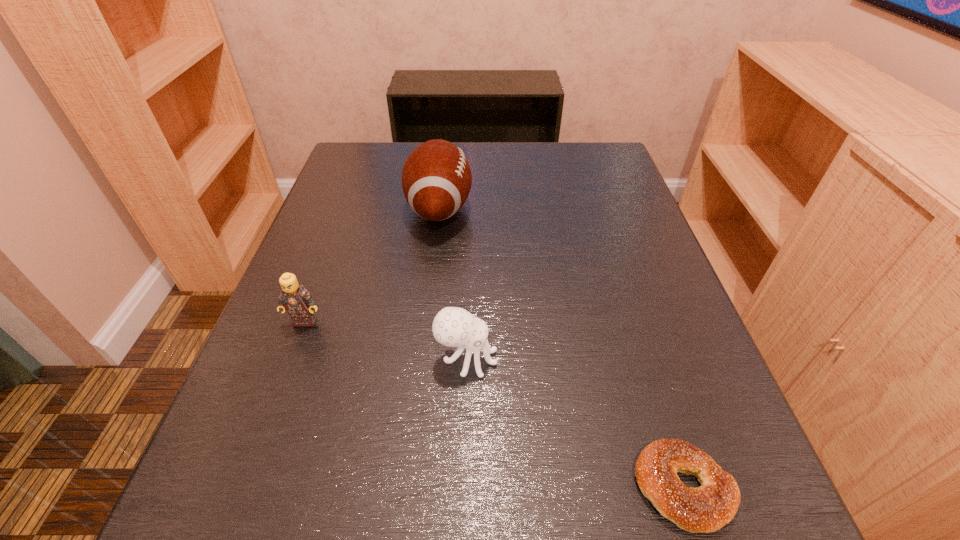
This screenshot has width=960, height=540. In order to click on football in this screenshot , I will do `click(436, 178)`.

Locate an element on the screen. the farthest object is located at coordinates (436, 178).

The image size is (960, 540). I want to click on the second farthest object, so click(294, 298).

In order to click on the leftmost object in this screenshot , I will do `click(294, 298)`.

Find the location of `the third farthest object`. the third farthest object is located at coordinates (455, 327).

What are the coordinates of `the nearest object` in the screenshot? It's located at (707, 508).

Where is `bagel`? bagel is located at coordinates (707, 508).

At what (x,y) coordinates should I click in order to perform the action: click on free point located on the laces of the tallest object. Please return your answer as a coordinate pair (x, y). The height and width of the screenshot is (540, 960). Looking at the image, I should click on click(x=568, y=208).

The width and height of the screenshot is (960, 540). In order to click on vacant area situated 0.210m in front of the leftmost object in this screenshot , I will do `click(258, 444)`.

You are a GUI agent. You are given a task and a screenshot of the screen. Output one action in this format:
    pyautogui.click(x=<x>, y=<y>)
    Task: Click on the vacant position located 0.120m on the front-facing side of the octopus
    Image resolution: width=960 pixels, height=540 pixels.
    Given the screenshot: What is the action you would take?
    pyautogui.click(x=571, y=359)